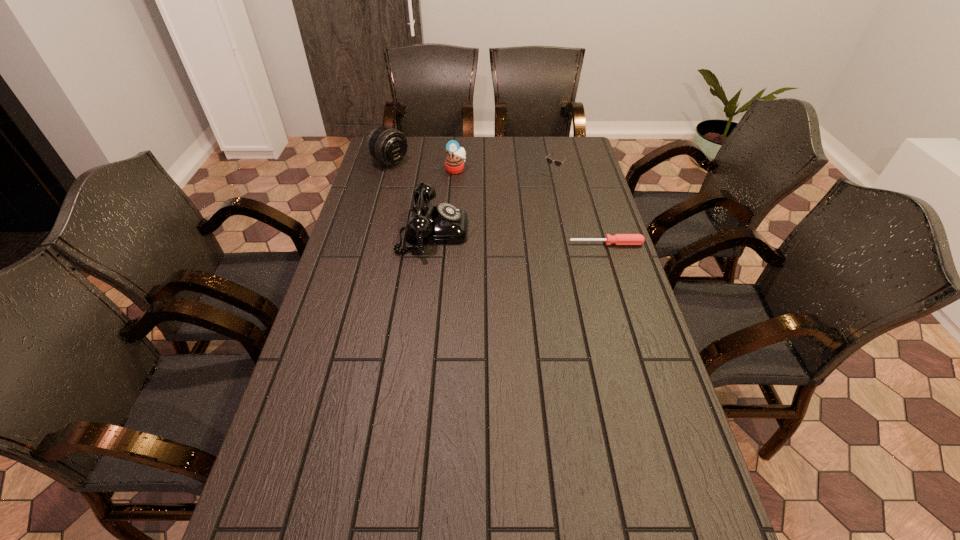
I want to click on screwdriver located at the right edge, so click(x=618, y=239).

Find the location of `sunglasses that is positioned at the right edge`. sunglasses that is positioned at the right edge is located at coordinates 549,160.

Locate an element on the screen. The height and width of the screenshot is (540, 960). object located in the far left corner section of the desktop is located at coordinates (387, 145).

I want to click on object that is at the far right corner, so click(549, 160).

In the image, there is a desktop. Identify the location of free space at the near edge. (368, 506).

In the image, there is a desktop. Where is `free space at the left edge`? free space at the left edge is located at coordinates (341, 306).

You are a GUI agent. You are given a task and a screenshot of the screen. Output one action in this format:
    pyautogui.click(x=<x>, y=<y>)
    Task: Click on the vacant area at the right edge of the desktop
    
    Given the screenshot: What is the action you would take?
    pyautogui.click(x=592, y=258)

The width and height of the screenshot is (960, 540). What are the coordinates of `free region at the far right corner of the desktop` in the screenshot? It's located at (574, 143).

Find the location of a particular element. The height and width of the screenshot is (540, 960). unoccupied position between the telephone and the telephoto lens is located at coordinates (411, 196).

The width and height of the screenshot is (960, 540). What are the coordinates of `unoccupied position between the muffin and the telephone` in the screenshot? It's located at (444, 200).